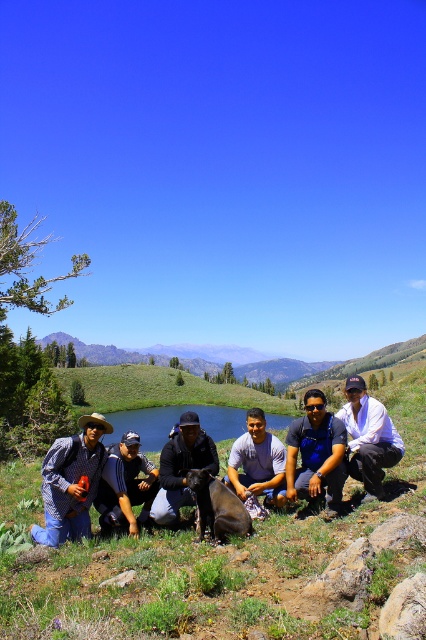
Does green grass at center have a smaller size compared to green grassy lake at center?

Yes, green grass at center is smaller than green grassy lake at center.

Which of these two, green grass at center or green grassy lake at center, stands taller?

With more height is green grassy lake at center.

Which is in front, point (290, 572) or point (195, 410)?

Positioned in front is point (290, 572).

Locate an element on the screen. green grass at center is located at coordinates (216, 564).

Does green grass at center appear under blue fabric shirt at center?

Yes, green grass at center is below blue fabric shirt at center.

Is green grass at center taller than blue fabric shirt at center?

Yes, green grass at center is taller than blue fabric shirt at center.

Image resolution: width=426 pixels, height=640 pixels. Describe the element at coordinates (216, 564) in the screenshot. I see `green grass at center` at that location.

Find the location of `green grass at center`. green grass at center is located at coordinates (216, 564).

Looking at this image, between green grass at center and dark blue jacket at center, which one appears on the left side from the viewer's perspective?

From the viewer's perspective, green grass at center appears more on the left side.

Is green grass at center to the left of dark blue jacket at center from the viewer's perspective?

Yes, green grass at center is to the left of dark blue jacket at center.

Between point (324, 596) and point (183, 476), which one is positioned behind?

Positioned behind is point (183, 476).

The image size is (426, 640). What are the coordinates of `green grass at center` in the screenshot? It's located at (216, 564).